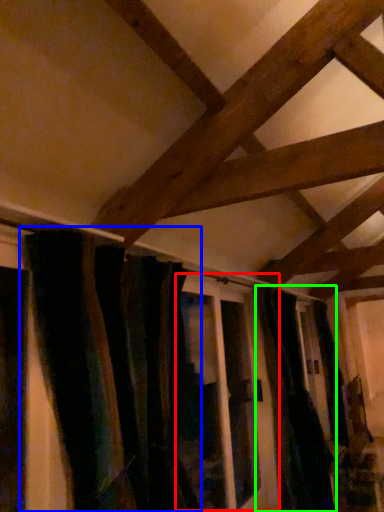
Question: Based on their relative distances, which object is farther from screen door (highlighted by a red box)? Choose from curtain (highlighted by a blue box) and curtain (highlighted by a green box).

Choices:
 (A) curtain
 (B) curtain

Answer: (A)